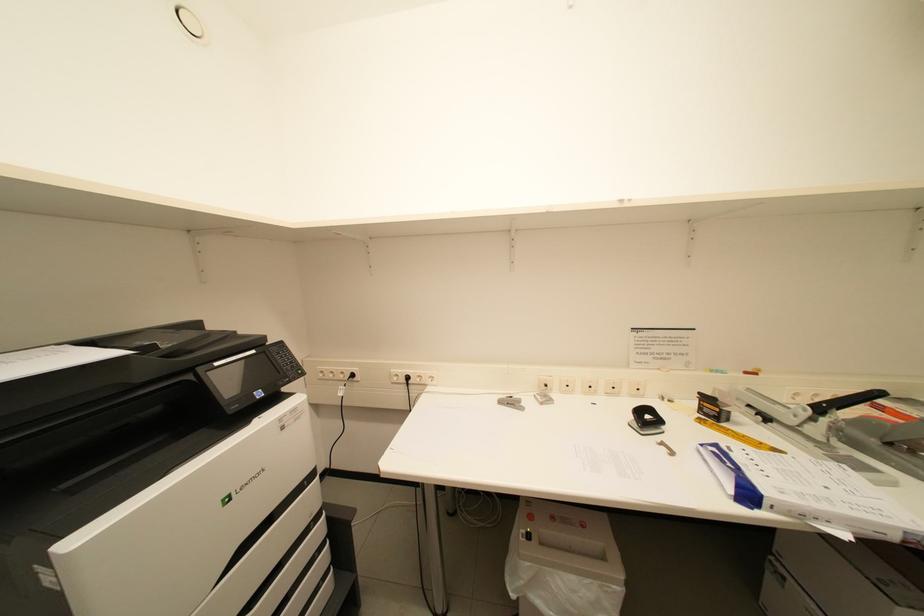
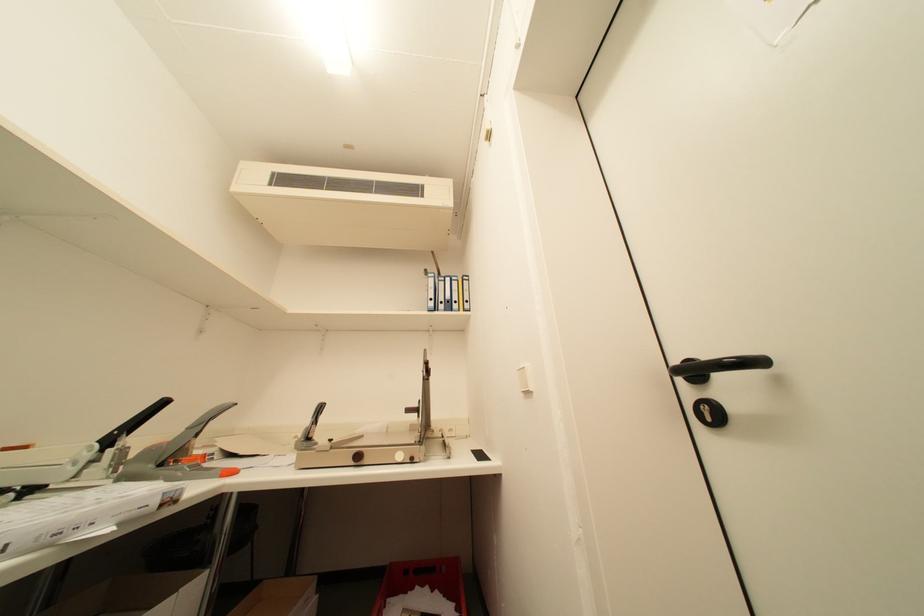
The images are taken continuously from a first-person perspective. In which direction is your viewpoint rotating?

The rotation direction of the camera is right-up.